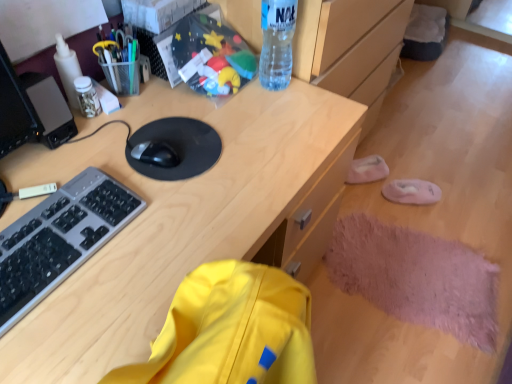
The width and height of the screenshot is (512, 384). In order to click on free location to the right of black matte mouse at center in this screenshot , I will do `click(221, 162)`.